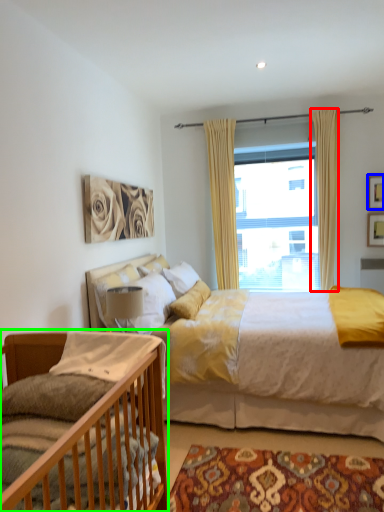
Question: Which object is positioned farthest from curtain (highlighted by a red box)? Select from picture frame (highlighted by a blue box) and bed (highlighted by a green box).

Choices:
 (A) picture frame
 (B) bed

Answer: (B)